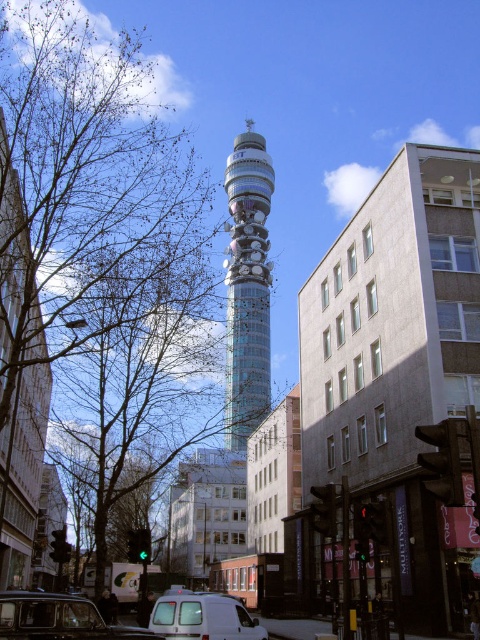
Question: Does black matte taxi at lower left have a greater width compared to white matte van at lower center?

Choices:
 (A) no
 (B) yes

Answer: (A)

Question: Which of the following is the farthest from the observer?

Choices:
 (A) white matte van at lower center
 (B) black matte taxi at lower left

Answer: (A)

Question: In this image, where is translucent glass tower at center located relative to black matte taxi at lower left?

Choices:
 (A) below
 (B) above

Answer: (B)

Question: Which of the following is the farthest from the observer?

Choices:
 (A) (230, 266)
 (B) (183, 595)
 (C) (83, 605)

Answer: (A)

Question: Which point is closer to the camera?

Choices:
 (A) translucent glass tower at center
 (B) white matte van at lower center
 (C) black matte taxi at lower left

Answer: (C)

Question: Observing the image, what is the correct spatial positioning of translucent glass tower at center in reference to black matte taxi at lower left?

Choices:
 (A) above
 (B) below

Answer: (A)